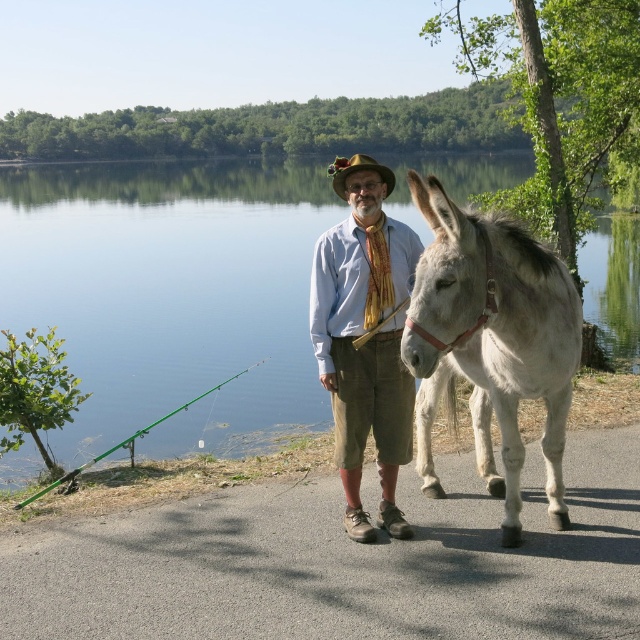
Who is more distant from viewer, [212,296] or [364,163]?

Point [212,296]

Who is lower down, clear blue water at center or brown felt cowboy hat at center?

Positioned lower is clear blue water at center.

The height and width of the screenshot is (640, 640). Identify the location of clear blue water at center. (170, 294).

Identify the location of clear blue water at center. This screenshot has height=640, width=640. (170, 294).

Is point (412, 332) positioned after point (339, 195)?

No.

Does gray matte donkey at right have a greater height compared to brown felt cowboy hat at center?

In fact, gray matte donkey at right may be shorter than brown felt cowboy hat at center.

Which is in front, point (435, 288) or point (342, 166)?

Positioned in front is point (435, 288).

Locate an element on the screen. This screenshot has height=640, width=640. gray matte donkey at right is located at coordinates (490, 342).

Can you confirm if clear blue water at center is thinner than light blue corduroy shirt at center?

No.

Is point (164, 356) farther from camera compared to point (394, 252)?

Yes, it is.

Where is `clear blue water at center`? The width and height of the screenshot is (640, 640). clear blue water at center is located at coordinates (170, 294).